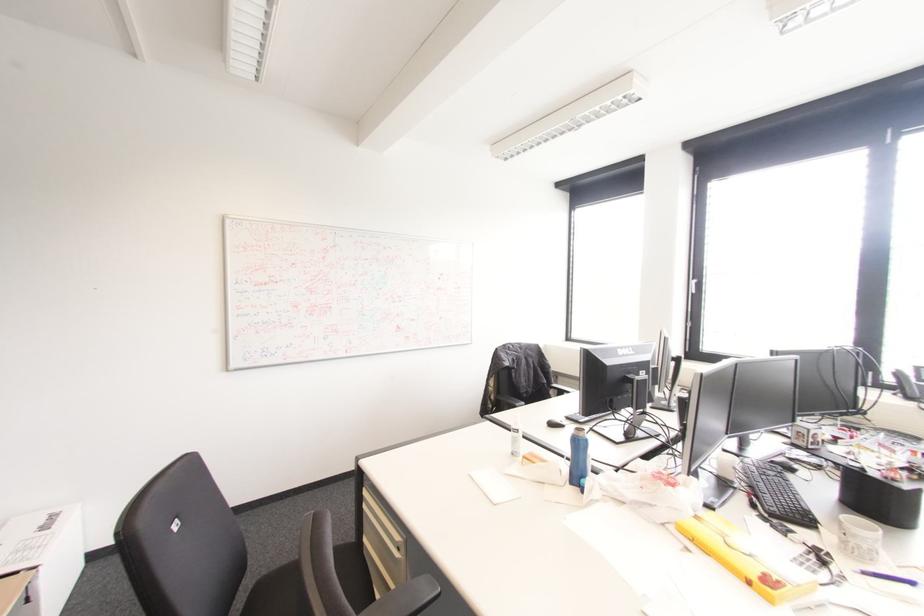
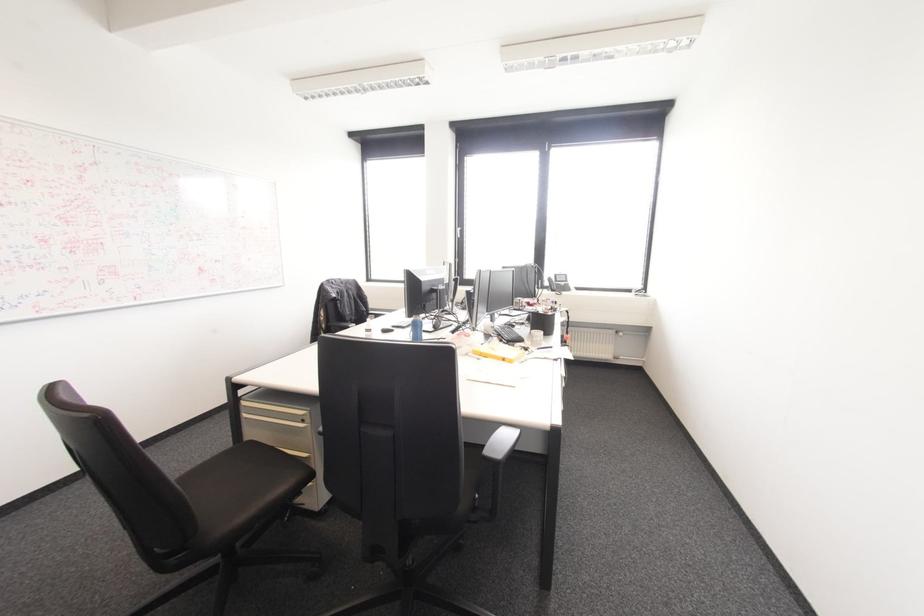
The point at (752, 506) is marked in the first image. Where is the corresponding point in the second image?

(500, 339)